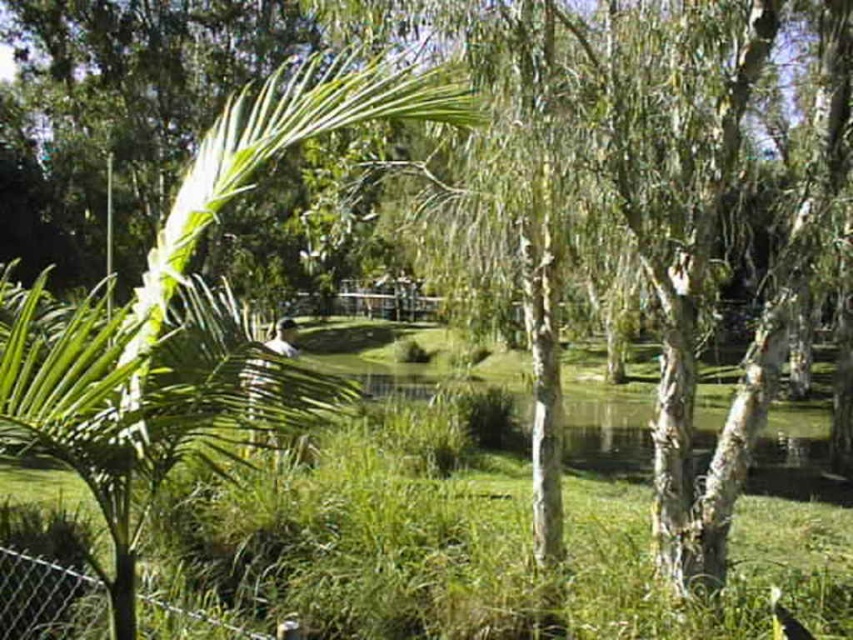
Question: Is green leafy palm tree at left closer to camera compared to metal chain-link fence at lower left?

Choices:
 (A) yes
 (B) no

Answer: (A)

Question: Does green leafy palm tree at left lie behind metal chain-link fence at lower left?

Choices:
 (A) yes
 (B) no

Answer: (B)

Question: Among these objects, which one is farthest from the camera?

Choices:
 (A) metal chain-link fence at lower left
 (B) green leafy palm tree at left

Answer: (A)

Question: Does green leafy palm tree at left appear on the right side of metal chain-link fence at lower left?

Choices:
 (A) yes
 (B) no

Answer: (B)

Question: Which point is closer to the camera taking this photo?

Choices:
 (A) tap(112, 326)
 (B) tap(210, 616)

Answer: (A)

Question: Which object appears farthest from the camera in this image?

Choices:
 (A) green leafy palm tree at left
 (B) metal chain-link fence at lower left

Answer: (B)